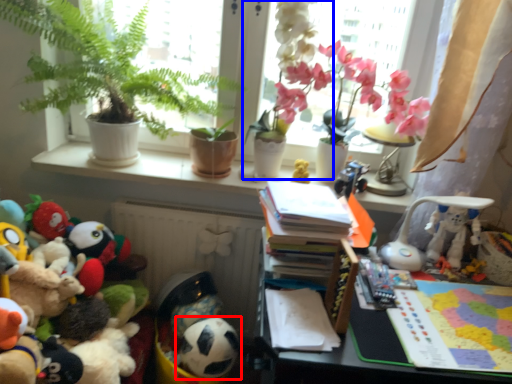
Question: Among these objects, which one is nearest to the camera, toy (highlighted by a red box) or houseplant (highlighted by a blue box)?

Choices:
 (A) toy
 (B) houseplant

Answer: (B)